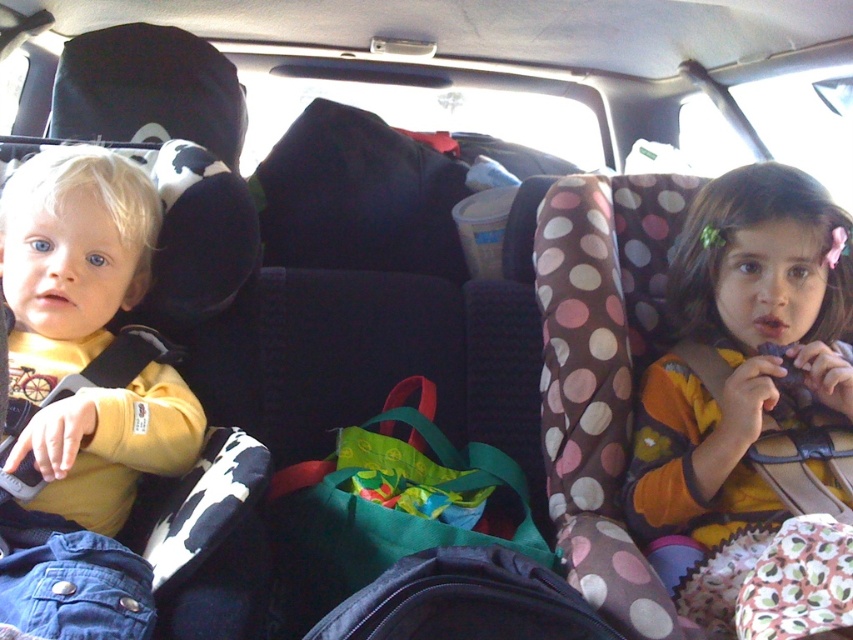
Question: Does matte yellow shirt at left come behind polka dot fabric car seat at right?

Choices:
 (A) no
 (B) yes

Answer: (A)

Question: Which point is closer to the camera?

Choices:
 (A) matte yellow shirt at left
 (B) polka dot fabric car seat at right

Answer: (A)

Question: Among these objects, which one is nearest to the camera?

Choices:
 (A) matte yellow shirt at left
 (B) polka dot fabric car seat at right

Answer: (A)

Question: Which of the following is the farthest from the observer?

Choices:
 (A) 840,416
 (B) 51,573

Answer: (A)

Question: Is matte yellow shirt at left positioned behind polka dot fabric car seat at right?

Choices:
 (A) yes
 (B) no

Answer: (B)

Question: Where is matte yellow shirt at left located in relation to polka dot fabric car seat at right in the image?

Choices:
 (A) right
 (B) left

Answer: (B)